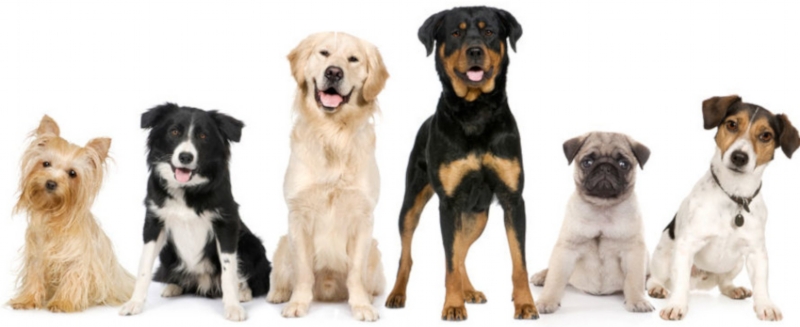
Where is `chests`? This screenshot has width=800, height=327. chests is located at coordinates (54, 249), (186, 233), (338, 175), (482, 155), (600, 230), (734, 235).